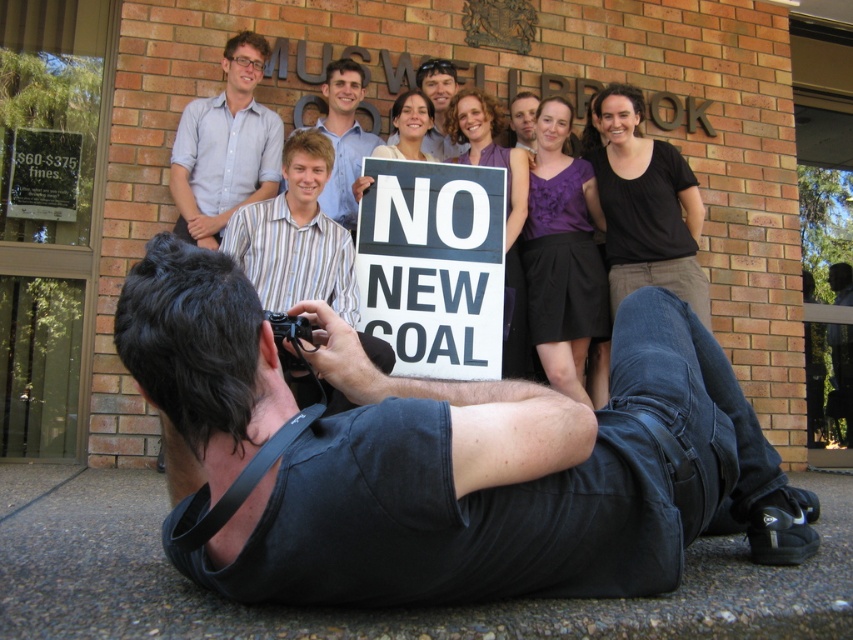
Question: Which object is closer to the camera taking this photo?

Choices:
 (A) light blue shirt at upper center
 (B) black cotton shirt at lower center
 (C) striped shirt at center
 (D) white plastic sign at center

Answer: (B)

Question: Does white plastic sign at center lie in front of striped shirt at center?

Choices:
 (A) no
 (B) yes

Answer: (B)

Question: Can you confirm if white plastic sign at center is positioned above striped shirt at center?

Choices:
 (A) yes
 (B) no

Answer: (B)

Question: Which object is the closest to the white paper sign at upper left?

Choices:
 (A) matte blue shirt at center
 (B) striped cotton shirt at center
 (C) black cotton shirt at lower center
 (D) white plastic sign at center

Answer: (B)

Question: Which object appears farthest from the camera in this image?

Choices:
 (A) white paper sign at upper left
 (B) striped cotton shirt at center
 (C) matte blue shirt at center
 (D) striped shirt at center

Answer: (C)

Question: Can you confirm if striped cotton shirt at center is wider than striped shirt at center?

Choices:
 (A) yes
 (B) no

Answer: (A)